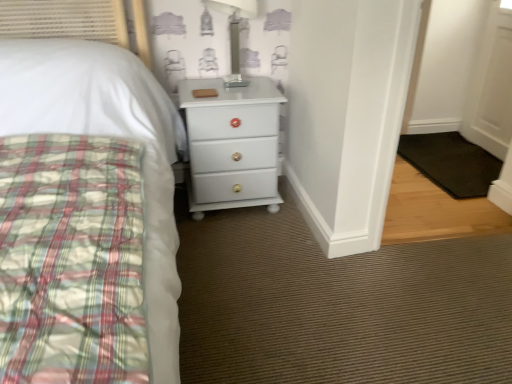
Where is `vacant area that lies in front of transparent glass table lamp at upper center`? The image size is (512, 384). vacant area that lies in front of transparent glass table lamp at upper center is located at coordinates (232, 96).